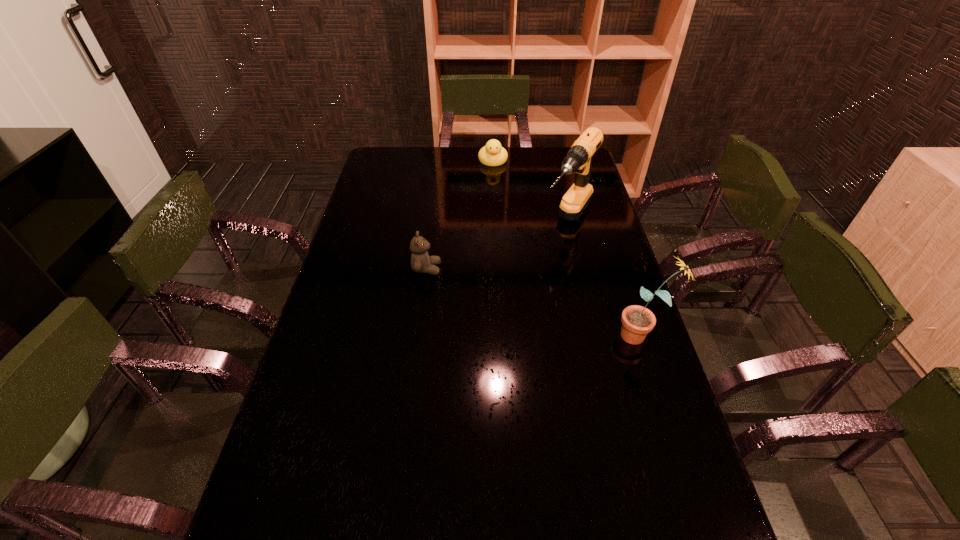
Identify the location of vacant space on the desktop that is between the leftmost object and the nearest object and is positioned at the tip of the third nearest object. The width and height of the screenshot is (960, 540). (516, 296).

At what (x,y) coordinates should I click in order to perform the action: click on free space on the desktop that is between the leftmost object and the sunflower and is positioned on the face of the duckling. Please return your answer as a coordinate pair (x, y). This screenshot has width=960, height=540. Looking at the image, I should click on (507, 294).